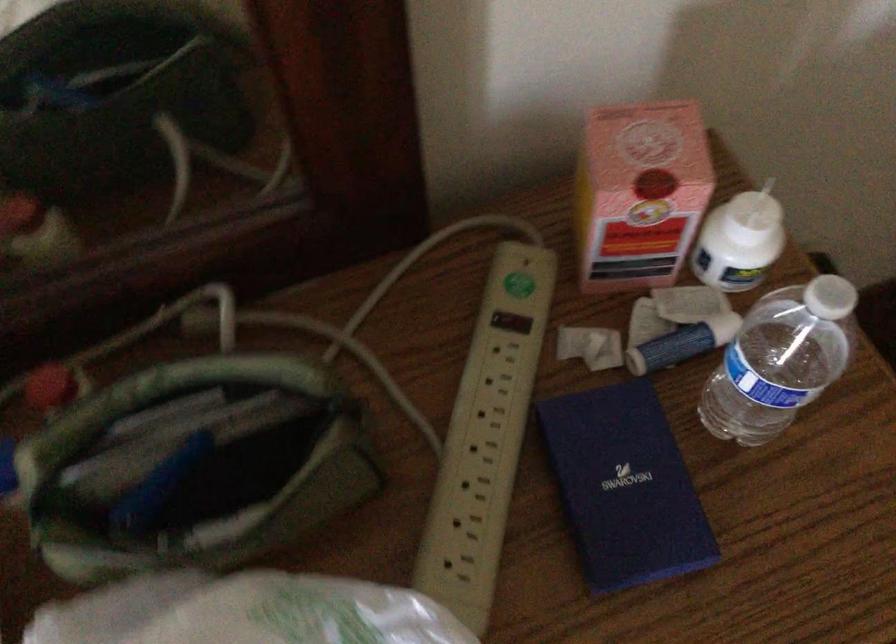
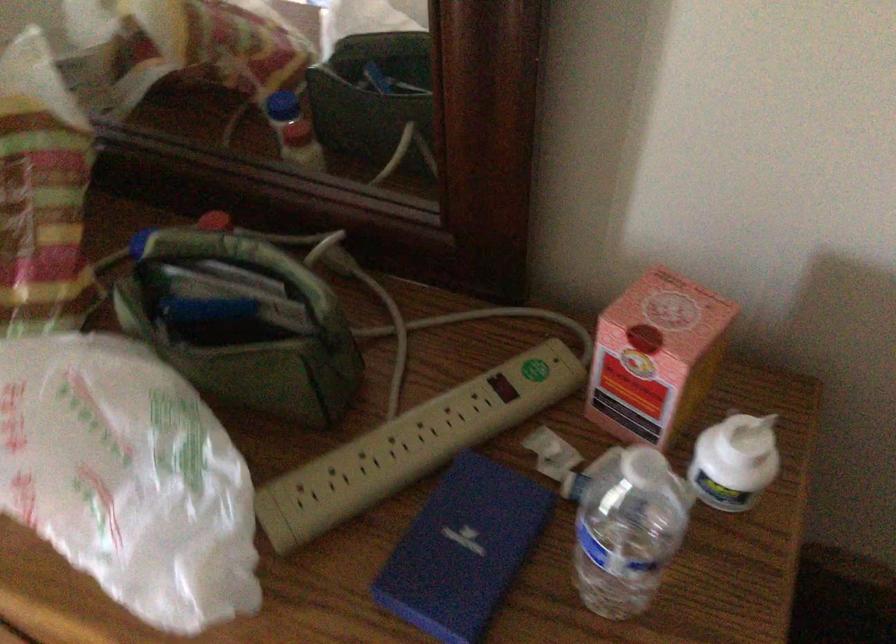
The point at (x=638, y=493) is marked in the first image. Where is the corresponding point in the second image?

(462, 550)